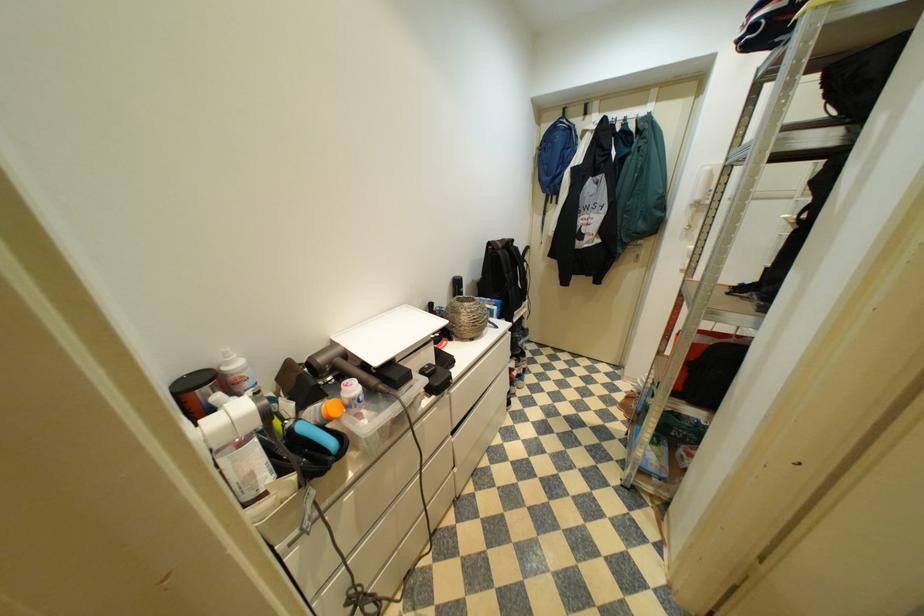
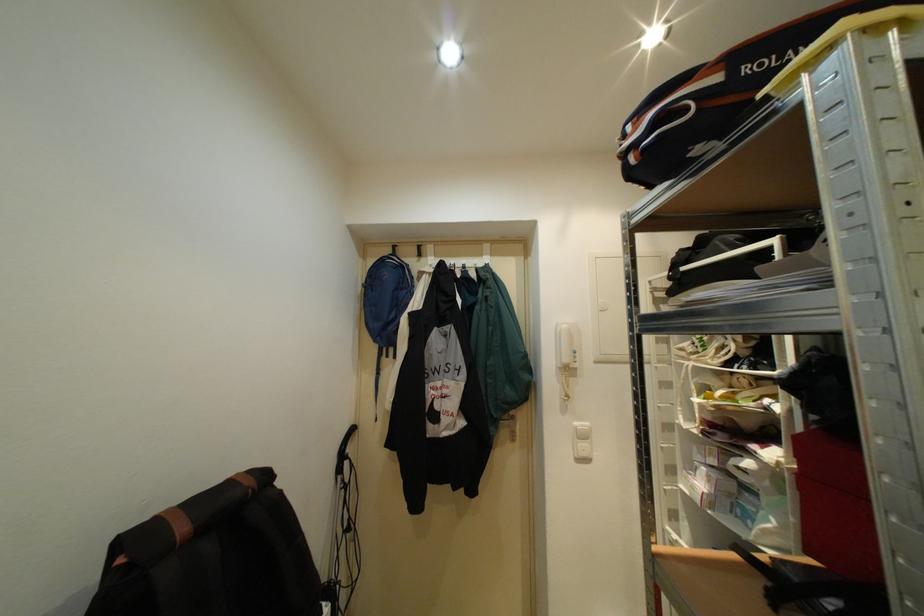
Where in the second image is the point corresponding to point 507,246 from the first image?

(191, 530)